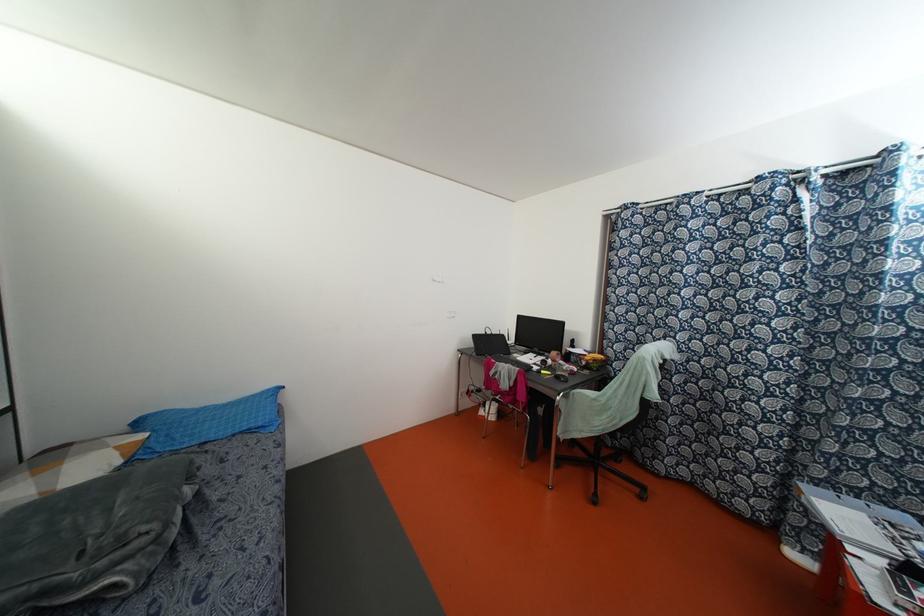
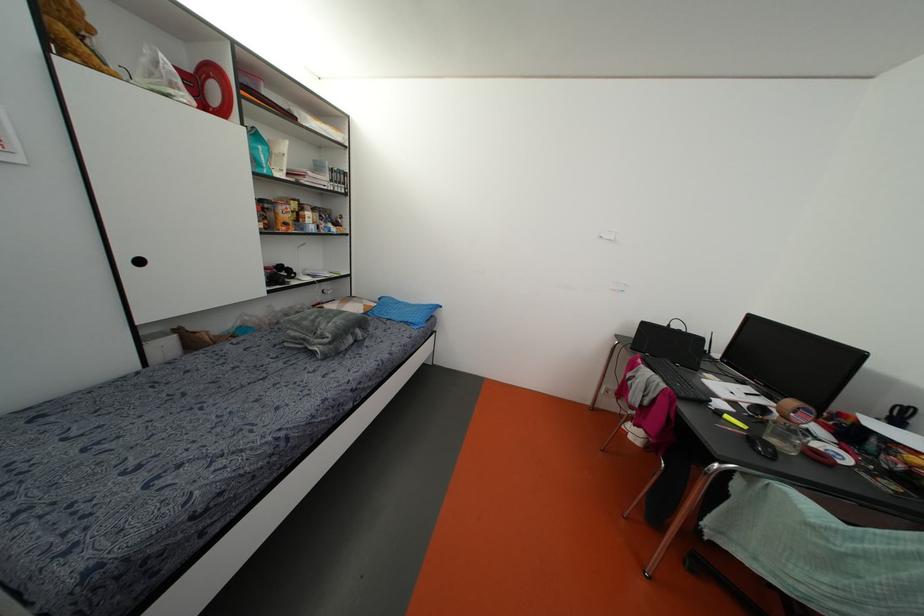
Question: The camera is either moving clockwise (left) or counter-clockwise (right) around the object. The first image is from the beginning of the video and the second image is from the end. Is the camera moving left or right when shooting the video?

Choices:
 (A) Left
 (B) Right

Answer: (B)